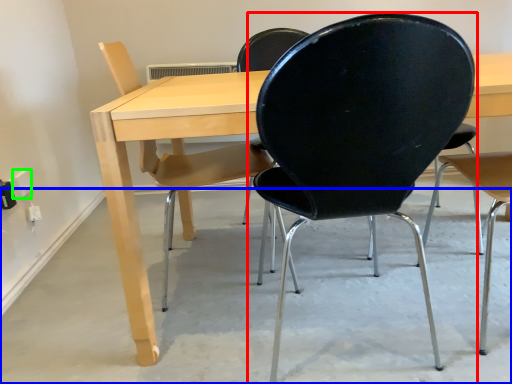
Question: Estimate the real-world distances between objects in this image. Which object is closer to chair (highlighted by a red box), concrete (highlighted by a blue box) or electric outlet (highlighted by a green box)?

Choices:
 (A) concrete
 (B) electric outlet

Answer: (A)